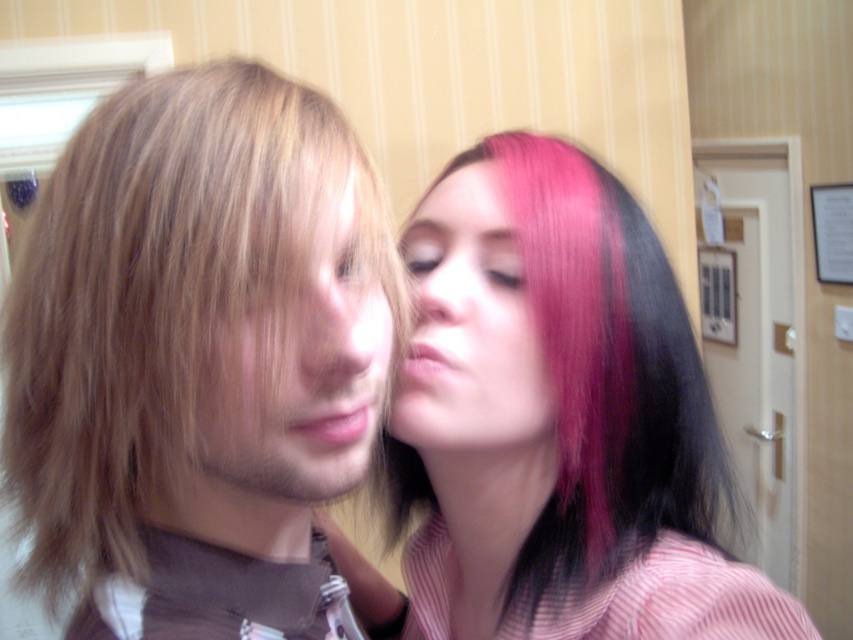
You are a hairstylist who needs to style two pink hair sections for a client. The client has the pink hair at center and the pink matte hair at upper center. Your task is to determine if the distance between these two sections is sufficient to create a visible separation between them. The minimum required separation for the style is 3 inches. Can you confirm if the distance is enough?

The distance between the pink hair at center and the pink matte hair at upper center is 2.93 inches, which is slightly less than the required 3 inches. Therefore, the separation is insufficient for the desired style.

You are an interior designer analyzing the placement of objects in the image. The pink hair at center is at coordinates point 0.512, 0.551. If you need to hang a picture frame exactly where the pink hair is currently located, would you recommend this spot for a focal point in the room?

The pink hair at center is located at point (469, 326). Since this position is central, it would make an excellent focal point for hanging the picture frame as it aligns with typical central focal points in interior design.